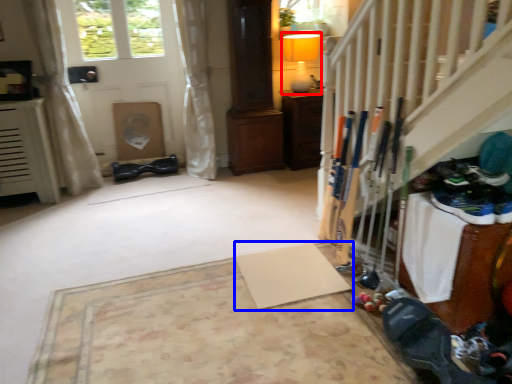
Question: Which object appears closest to the camera in this image, lamp (highlighted by a red box) or yoga mat (highlighted by a blue box)?

Choices:
 (A) lamp
 (B) yoga mat

Answer: (B)